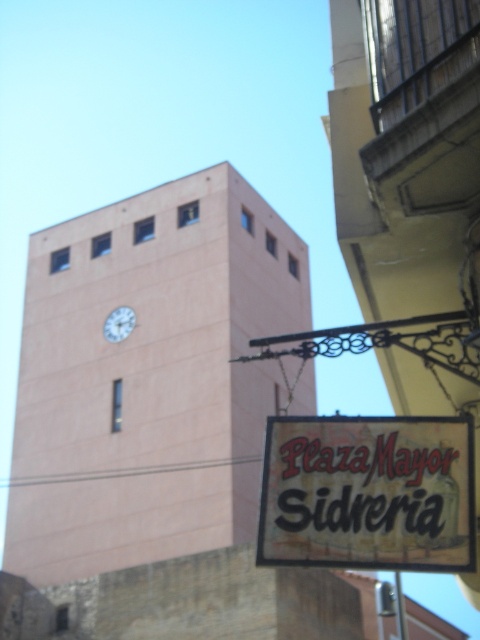
Based on the scene description, where is the matte pink clock tower at center located in terms of its 2D coordinates?

The matte pink clock tower at center is located at coordinates point (157,426).

You are a delivery person who needs to park your van in front of the Plaza Mayor Sidreria. The van requires a parking space that is at least 15 meters long. Based on the distance between the matte pink clock tower at center and the white glossy clock at upper center, can you safely park your van here?

The distance between the matte pink clock tower at center and the white glossy clock at upper center is 14.45 meters. Since the van requires at least 15 meters, the parking space is too short. You cannot safely park your van here.

From the picture: You are standing in front of the Plaza Mayor Sidreria and want to take a photo of the matte pink clock tower at center and the matte black sign at lower right. If you want the clock tower to appear to the left of the sign in your photo, should you position yourself to the left or right of the current spot?

The matte pink clock tower at center is positioned on the left side of the matte black sign at lower right, so to have the clock tower appear to the left of the sign in your photo, you should position yourself to the right of your current spot.